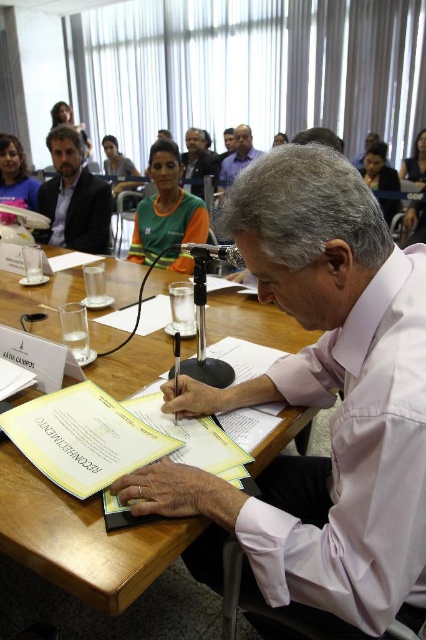
What object is located at the coordinates point (x=80, y=538) in the image?

The wooden table at center is located at point (x=80, y=538).

You are organizing a presentation and need to place a laptop on the wooden table at center. Considering the space occupied by the matte black shirt at center, will there be enough room for the laptop?

The wooden table at center might be wider than matte black shirt at center, so there could be enough space for the laptop depending on the shirt size and table dimensions.

You are organizing a small event and need to place a 1.5 meter long banner on the wooden table at center. Considering the size of the matte black shirt at center, will there be enough space for the banner?

The wooden table at center is larger in size than the matte black shirt at center, so there should be enough space to place the 1.5 meter long banner on the wooden table at center.